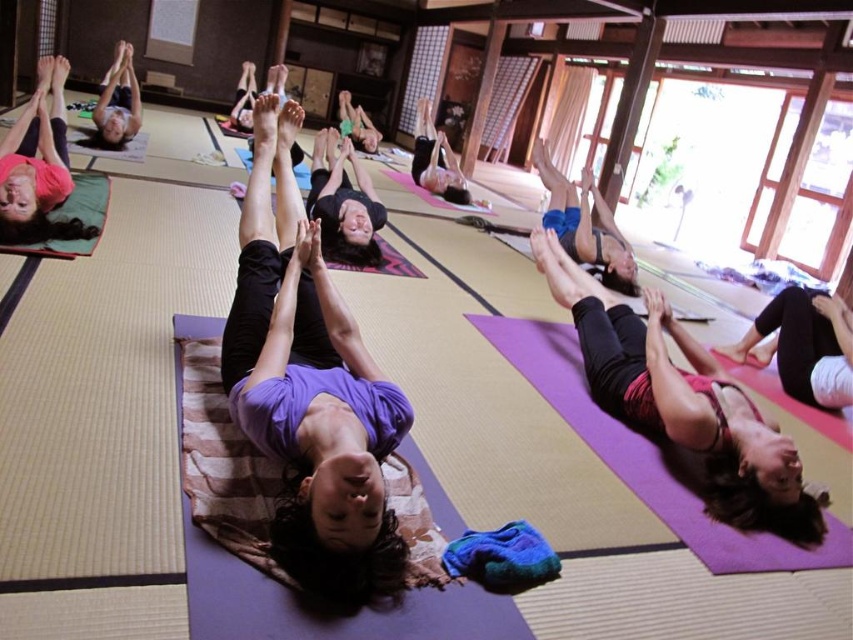
You are a yoga instructor observing the class. You notice two yoga mats, the matte green yoga mat at lower left and the matte black yoga mat at center. Which mat would you recommend for a taller student to ensure comfort during the pose?

The matte green yoga mat at lower left is bigger than the matte black yoga mat at center, so it would be more comfortable for a taller student.

You are a yoga instructor observing the class. You notice the matte green yoga mat at lower left. Where exactly is it positioned in the room?

The matte green yoga mat at lower left is located at point (38, 166).